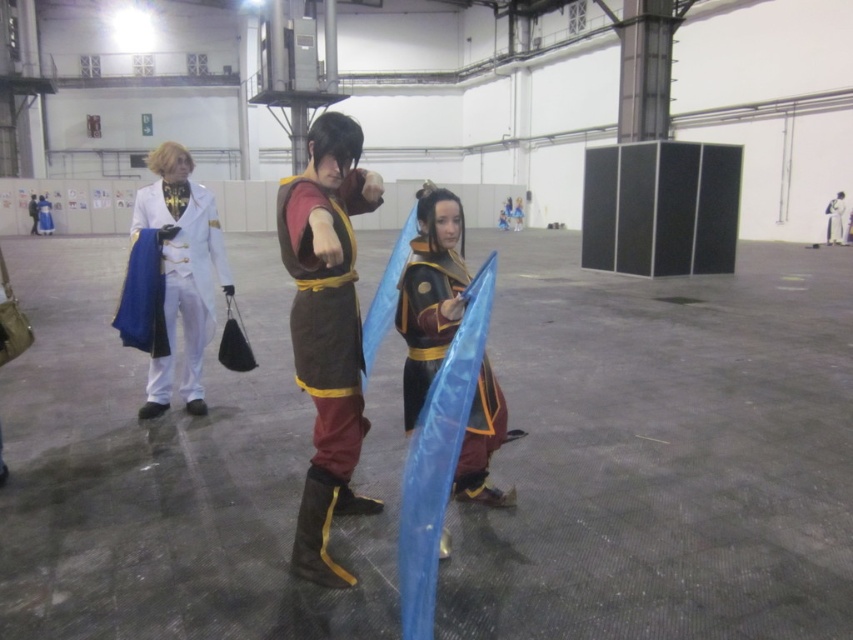
Question: Can you confirm if white glossy coat at left is positioned to the right of white glossy coat at center?

Choices:
 (A) no
 (B) yes

Answer: (A)

Question: Based on their relative distances, which object is nearer to the brown leather tunic at center?

Choices:
 (A) shiny gold armor at center
 (B) white glossy coat at center

Answer: (A)

Question: Is shiny gold armor at center above white glossy coat at center?

Choices:
 (A) yes
 (B) no

Answer: (B)

Question: Which point is farther to the camera?

Choices:
 (A) (210, 236)
 (B) (431, 326)

Answer: (A)

Question: Is brown leather tunic at center above white glossy coat at left?

Choices:
 (A) no
 (B) yes

Answer: (B)

Question: Among these points, which one is farthest from the camera?

Choices:
 (A) (834, 209)
 (B) (164, 308)

Answer: (A)